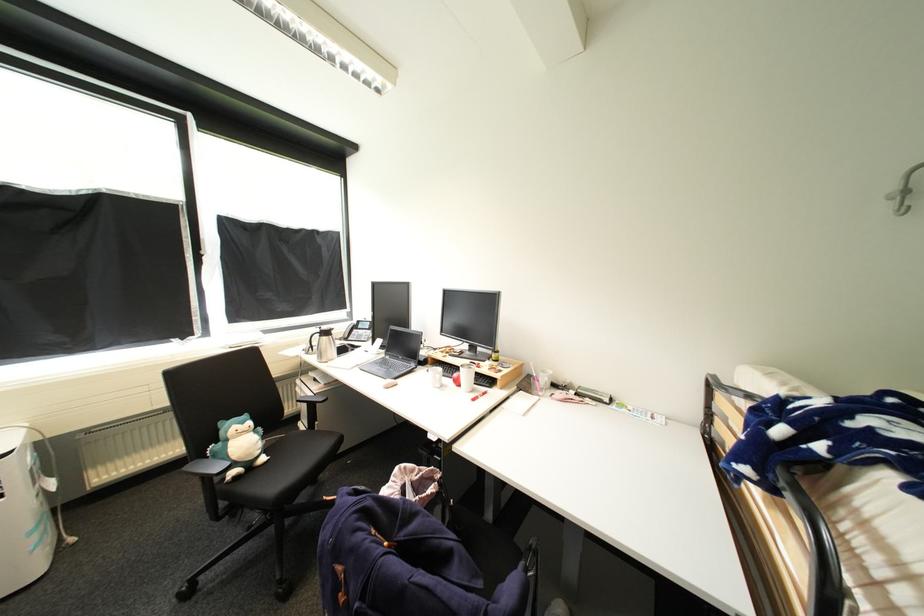
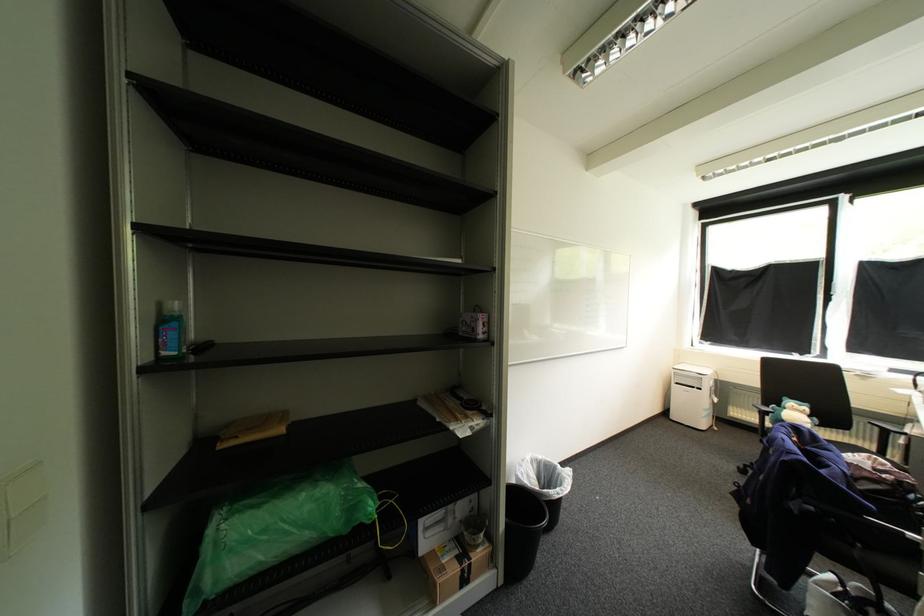
Where in the second image is the point corresponding to (x=234, y=440) from the first image?

(792, 408)